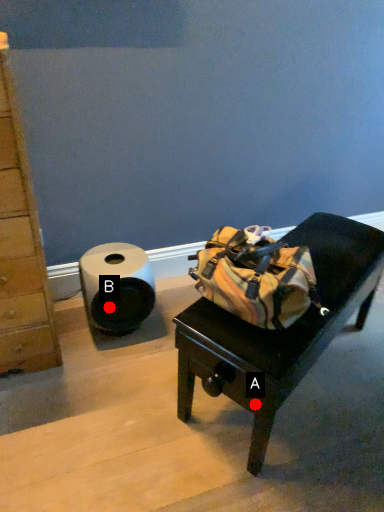
Question: Two points are circled on the image, labeled by A and B beside each circle. Which point is closer to the camera?

Choices:
 (A) A is closer
 (B) B is closer

Answer: (A)